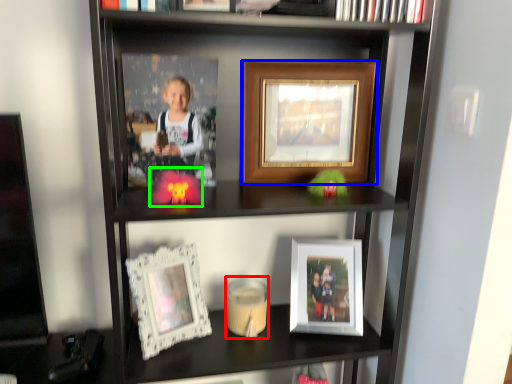
Question: Which object is the closest to the candle holder (highlighted by a red box)? Choose among these: picture frame (highlighted by a blue box) or toy (highlighted by a green box).

Choices:
 (A) picture frame
 (B) toy

Answer: (B)